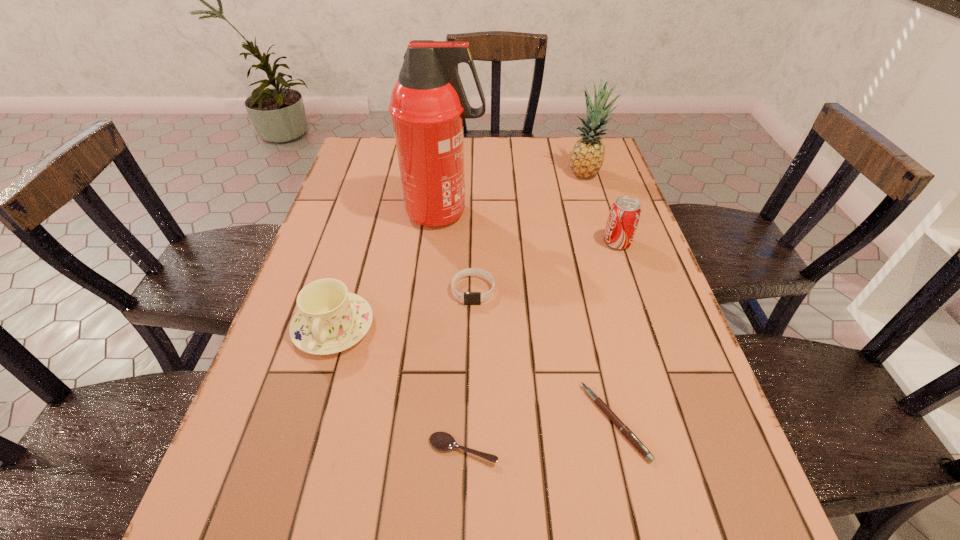
Where is `blank space at the far left corner of the desktop`? The width and height of the screenshot is (960, 540). blank space at the far left corner of the desktop is located at coordinates (389, 148).

The height and width of the screenshot is (540, 960). I want to click on vacant area that lies between the tallest object and the shortest object, so click(x=454, y=331).

At what (x,y) coordinates should I click in order to perform the action: click on vacant area between the soda and the second farthest object. Please return your answer as a coordinate pair (x, y). The width and height of the screenshot is (960, 540). Looking at the image, I should click on (531, 228).

I want to click on free space between the wristband and the shortest object, so click(x=468, y=370).

Locate an element on the screen. This screenshot has width=960, height=540. vacant space that is in between the fourth tallest object and the sixth shortest object is located at coordinates (460, 250).

Where is `free space between the fire extinguisher and the fourth tallest object`? The image size is (960, 540). free space between the fire extinguisher and the fourth tallest object is located at coordinates (389, 270).

The height and width of the screenshot is (540, 960). Find the location of `empty space that is in between the soupspoon and the pen`. empty space that is in between the soupspoon and the pen is located at coordinates (540, 435).

In order to click on vacant space in between the chinaware and the soda in this screenshot , I will do `click(475, 285)`.

Locate an element on the screen. The width and height of the screenshot is (960, 540). vacant area that lies between the pineapple and the pen is located at coordinates (600, 298).

Locate an element on the screen. vacant area that lies between the sixth shortest object and the fifth shortest object is located at coordinates (601, 208).